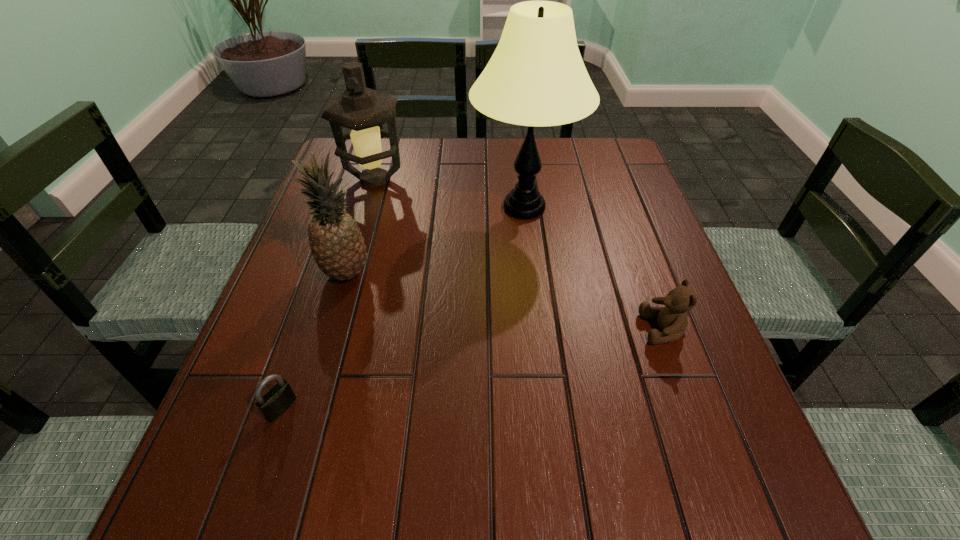
At what (x,y) coordinates should I click in order to perform the action: click on the tallest object. Please return your answer as a coordinate pair (x, y). Image resolution: width=960 pixels, height=540 pixels. Looking at the image, I should click on point(536,77).

Locate an element on the screen. This screenshot has height=540, width=960. the fourth object from left to right is located at coordinates (536, 77).

You are a GUI agent. You are given a task and a screenshot of the screen. Output one action in this format:
    pyautogui.click(x=<x>, y=<y>)
    Task: Click on the oil lamp
    
    Given the screenshot: What is the action you would take?
    pyautogui.click(x=361, y=109)

Where is `pineapple`? The image size is (960, 540). pineapple is located at coordinates 336,242.

The height and width of the screenshot is (540, 960). I want to click on teddy bear, so click(x=672, y=319).

Find the location of a particular element. The height and width of the screenshot is (540, 960). the rightmost object is located at coordinates (672, 319).

You are a GUI agent. You are given a task and a screenshot of the screen. Output one action in this format:
    pyautogui.click(x=<x>, y=<y>)
    Task: Click on the shortest object
    Image resolution: width=960 pixels, height=540 pixels.
    Given the screenshot: What is the action you would take?
    pyautogui.click(x=279, y=398)

Locate an element on the screen. This screenshot has height=540, width=960. padlock is located at coordinates (279, 398).

At what (x,y) coordinates should I click in order to perform the action: click on vacant space located 0.180m on the right of the lamp. Please return your answer as a coordinate pair (x, y). The height and width of the screenshot is (540, 960). Looking at the image, I should click on (648, 207).

Locate an element on the screen. vacant space situated 0.050m on the front of the oil lamp is located at coordinates (365, 213).